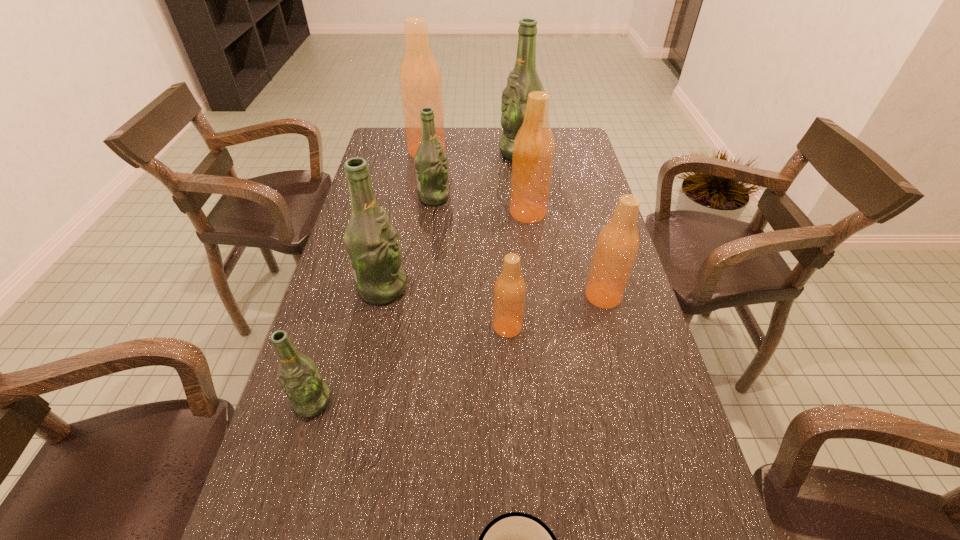
Locate an element on the screen. The height and width of the screenshot is (540, 960). the second nearest beer bottle is located at coordinates (510, 288).

What are the coordinates of `the smallest green beer bottle` in the screenshot? It's located at (309, 395).

Where is `the second nearest object`? the second nearest object is located at coordinates (309, 395).

Where is `vacant space situated on the surface of the rightmost green beer bottle`? This screenshot has height=540, width=960. vacant space situated on the surface of the rightmost green beer bottle is located at coordinates (464, 153).

What are the coordinates of `vacant space situated on the surface of the rightmost green beer bottle` in the screenshot? It's located at (456, 153).

This screenshot has width=960, height=540. Find the location of `vacant space located 0.060m on the surface of the rightmost green beer bottle`. vacant space located 0.060m on the surface of the rightmost green beer bottle is located at coordinates (483, 153).

At what (x,y) coordinates should I click in order to perform the action: click on vacant point located on the front of the biggest tan beer bottle. Please return your answer as a coordinate pair (x, y). Looking at the image, I should click on (420, 198).

Identify the location of vacant area located 0.240m on the surface of the second biggest green beer bottle. (498, 288).

The height and width of the screenshot is (540, 960). Find the location of `free location located on the back of the second biggest tan beer bottle`. free location located on the back of the second biggest tan beer bottle is located at coordinates (519, 141).

The height and width of the screenshot is (540, 960). I want to click on vacant space located 0.390m on the surface of the third nearest green beer bottle, so pyautogui.click(x=568, y=198).